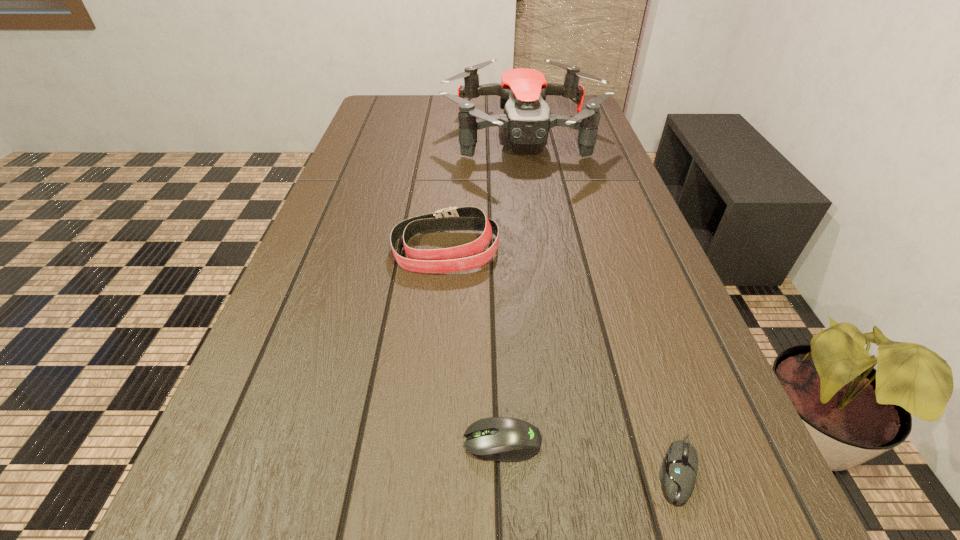
At what (x,y) coordinates should I click in order to perform the action: click on free space that satisfies the following two spatial constraints: 1. on the wheel side of the left computer mouse; 2. on the left side of the shorter computer mouse. Please return your answer as a coordinate pair (x, y). The height and width of the screenshot is (540, 960). Looking at the image, I should click on (503, 469).

Identify the location of blank area in the image that satisfies the following two spatial constraints: 1. on the wheel side of the shorter computer mouse; 2. on the left side of the taller computer mouse. This screenshot has height=540, width=960. (503, 469).